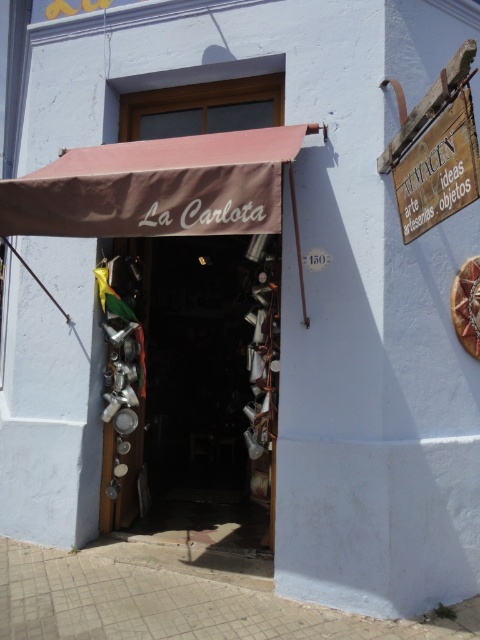
Question: Can you confirm if metallic pots at center is positioned above brown fabric awning at upper center?

Choices:
 (A) no
 (B) yes

Answer: (A)

Question: Is metallic pots at center wider than brown fabric awning at upper center?

Choices:
 (A) no
 (B) yes

Answer: (A)

Question: Which point is closer to the camera?

Choices:
 (A) metallic pots at center
 (B) wooden sign at upper right

Answer: (B)

Question: Which of these objects is positioned closest to the brown fabric awning at upper center?

Choices:
 (A) metallic pots at center
 (B) wooden sign at upper right

Answer: (B)

Question: Can you confirm if metallic pots at center is smaller than brown fabric awning at upper center?

Choices:
 (A) yes
 (B) no

Answer: (B)

Question: Which object appears closest to the camera in this image?

Choices:
 (A) brown fabric awning at upper center
 (B) metallic pots at center
 (C) wooden sign at upper right

Answer: (C)